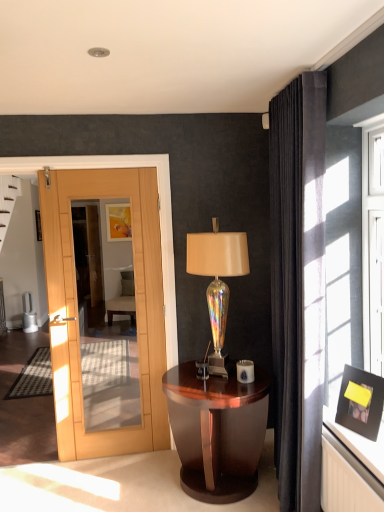
Question: Is iridescent glass table lamp at center positioned beyond the bounds of glossy wood nightstand at center?

Choices:
 (A) no
 (B) yes

Answer: (B)

Question: Is iridescent glass table lamp at center closer to the viewer compared to glossy wood nightstand at center?

Choices:
 (A) no
 (B) yes

Answer: (A)

Question: Is iridescent glass table lamp at center beside glossy wood nightstand at center?

Choices:
 (A) no
 (B) yes

Answer: (A)

Question: From a real-world perspective, is iridescent glass table lamp at center over glossy wood nightstand at center?

Choices:
 (A) no
 (B) yes

Answer: (B)

Question: Is iridescent glass table lamp at center shorter than glossy wood nightstand at center?

Choices:
 (A) yes
 (B) no

Answer: (B)

Question: Is glossy wood nightstand at center wider or thinner than iridescent glass table lamp at center?

Choices:
 (A) thin
 (B) wide

Answer: (B)

Question: Looking at the image, does glossy wood nightstand at center seem bigger or smaller compared to iridescent glass table lamp at center?

Choices:
 (A) small
 (B) big

Answer: (B)

Question: Visually, is glossy wood nightstand at center positioned to the left or to the right of iridescent glass table lamp at center?

Choices:
 (A) right
 (B) left

Answer: (B)

Question: From a real-world perspective, relative to iridescent glass table lamp at center, is glossy wood nightstand at center vertically above or below?

Choices:
 (A) below
 (B) above

Answer: (A)

Question: Choose the correct answer: Is velvet dark gray curtain at right inside matte gold picture frame at upper center, which is the first picture frame from back to front, or outside it?

Choices:
 (A) outside
 (B) inside

Answer: (A)

Question: In terms of height, does velvet dark gray curtain at right look taller or shorter compared to matte gold picture frame at upper center, the second picture frame when ordered from front to back?

Choices:
 (A) short
 (B) tall

Answer: (B)

Question: From the image's perspective, is velvet dark gray curtain at right positioned above or below matte gold picture frame at upper center, which is the first picture frame from back to front?

Choices:
 (A) above
 (B) below

Answer: (B)

Question: In the image, is velvet dark gray curtain at right on the left side or the right side of matte gold picture frame at upper center, the second picture frame when ordered from front to back?

Choices:
 (A) right
 (B) left

Answer: (A)

Question: Is matte black picture frame at upper right, the second picture frame from the top, inside the boundaries of velvet dark gray curtain at right, or outside?

Choices:
 (A) outside
 (B) inside

Answer: (A)

Question: From a real-world perspective, is matte black picture frame at upper right, which is the 2th picture frame from back to front, positioned above or below velvet dark gray curtain at right?

Choices:
 (A) below
 (B) above

Answer: (A)